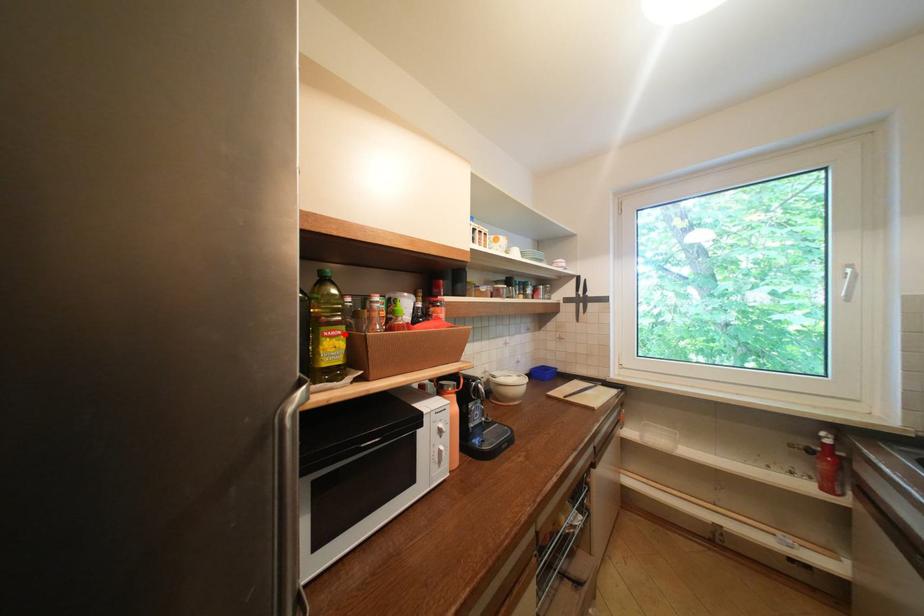
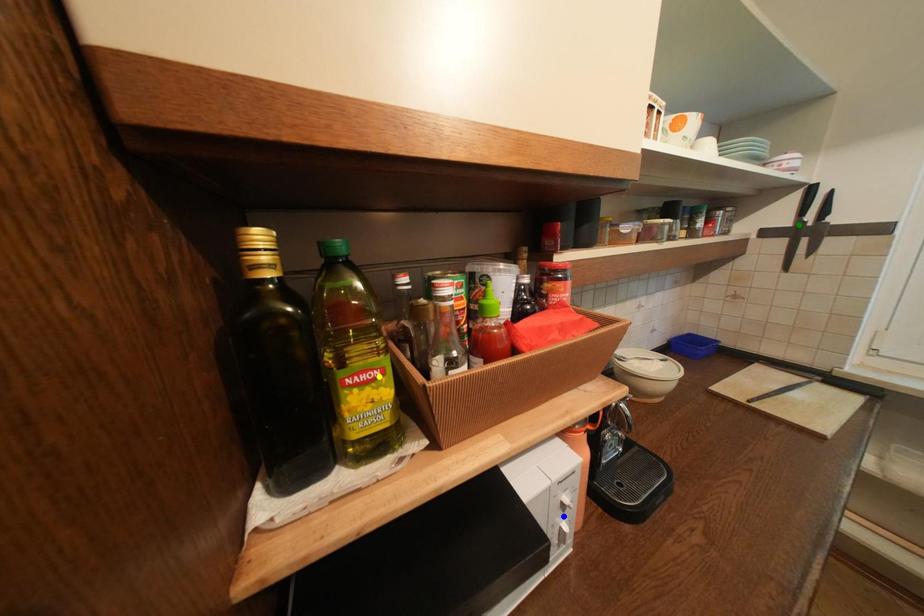
Question: I am providing you with two images of the same scene from different viewpoints. A red point is marked on the first image. You are given multiple points on the second image. Which mark in image 2 goes with the point in image 1?

Choices:
 (A) blue point
 (B) yellow point
 (C) green point

Answer: (B)